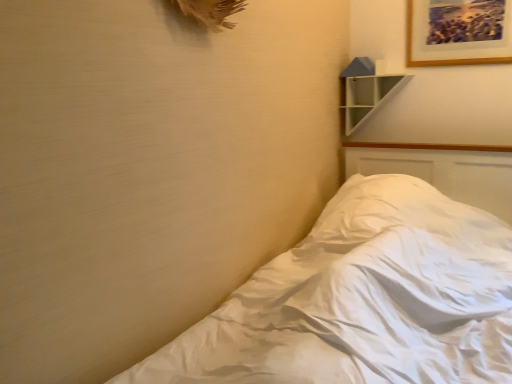
Question: Are wooden picture frame at upper right and white glossy shelf at upper right far apart?

Choices:
 (A) yes
 (B) no

Answer: (B)

Question: From a real-world perspective, is wooden picture frame at upper right beneath white glossy shelf at upper right?

Choices:
 (A) no
 (B) yes

Answer: (A)

Question: Can we say wooden picture frame at upper right lies outside white glossy shelf at upper right?

Choices:
 (A) yes
 (B) no

Answer: (A)

Question: Is wooden picture frame at upper right wider than white glossy shelf at upper right?

Choices:
 (A) yes
 (B) no

Answer: (B)

Question: Is wooden picture frame at upper right touching white glossy shelf at upper right?

Choices:
 (A) yes
 (B) no

Answer: (B)

Question: Considering the relative sizes of wooden picture frame at upper right and white glossy shelf at upper right in the image provided, is wooden picture frame at upper right bigger than white glossy shelf at upper right?

Choices:
 (A) no
 (B) yes

Answer: (A)

Question: Is wooden picture frame at upper right beside white soft bed at lower right?

Choices:
 (A) no
 (B) yes

Answer: (A)

Question: Is white soft bed at lower right located within wooden picture frame at upper right?

Choices:
 (A) yes
 (B) no

Answer: (B)

Question: Considering the relative sizes of wooden picture frame at upper right and white soft bed at lower right in the image provided, is wooden picture frame at upper right taller than white soft bed at lower right?

Choices:
 (A) no
 (B) yes

Answer: (A)

Question: From a real-world perspective, is wooden picture frame at upper right located higher than white soft bed at lower right?

Choices:
 (A) yes
 (B) no

Answer: (A)

Question: From a real-world perspective, is wooden picture frame at upper right under white soft bed at lower right?

Choices:
 (A) yes
 (B) no

Answer: (B)

Question: Can we say wooden picture frame at upper right lies outside white soft bed at lower right?

Choices:
 (A) yes
 (B) no

Answer: (A)

Question: Is white glossy shelf at upper right facing away from wooden picture frame at upper right?

Choices:
 (A) yes
 (B) no

Answer: (B)